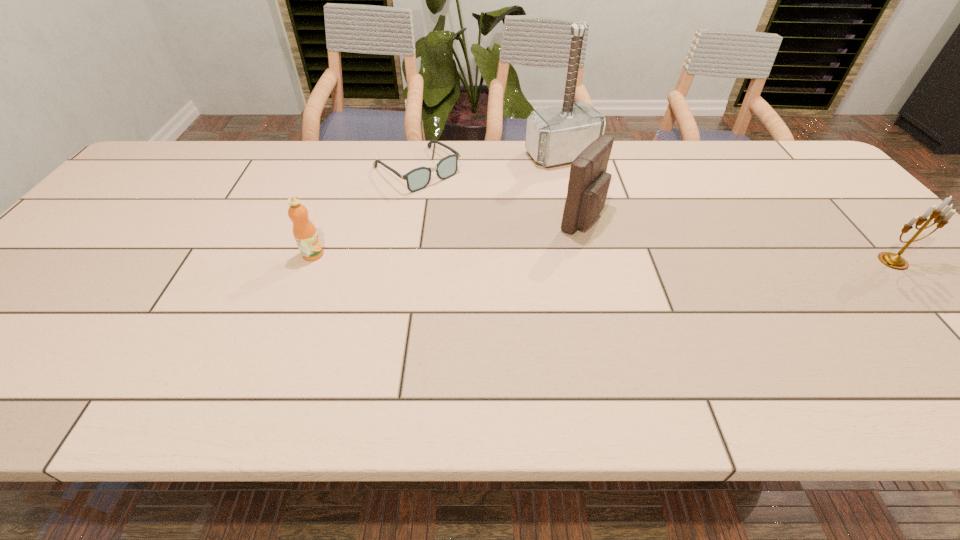
Find the location of a particular element. This screenshot has width=960, height=540. free space on the desktop that is between the second shortest object and the candelabrum and is positioned with an open flap on the third nearest object is located at coordinates (684, 259).

I want to click on vacant space on the desktop that is between the second shortest object and the rightmost object and is positioned for striking with the head of the tallest object, so click(x=653, y=258).

Find the location of `free space on the desktop that is between the orange juice and the rightmost object and is positioned on the face of the spectacles`. free space on the desktop that is between the orange juice and the rightmost object and is positioned on the face of the spectacles is located at coordinates (520, 257).